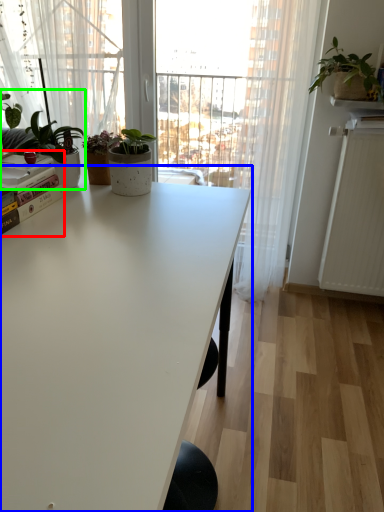
Question: Estimate the real-world distances between objects in this image. Which object is farther from book (highlighted by a red box), table (highlighted by a blue box) or houseplant (highlighted by a green box)?

Choices:
 (A) table
 (B) houseplant

Answer: (A)